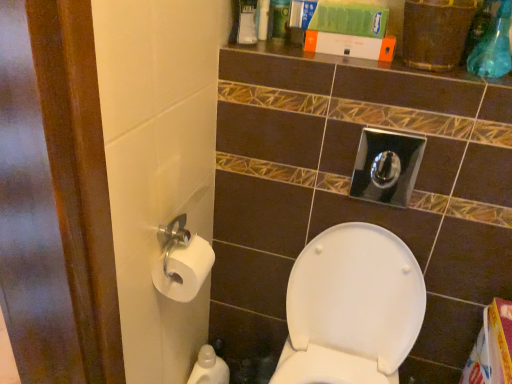
Find the location of `white glossy toilet seat at center`. white glossy toilet seat at center is located at coordinates (351, 308).

Is point (260, 11) closer or farther from the camera than point (328, 278)?

Point (260, 11).

The height and width of the screenshot is (384, 512). In order to click on the 2nd toiletry above the white glossy toilet seat at center (from a real-world perspective) in this screenshot , I will do `click(263, 19)`.

Looking at this image, is white plastic container at upper center, acting as the 2th toiletry starting from the left, oriented away from white glossy toilet seat at center?

No, white plastic container at upper center, acting as the 2th toiletry starting from the left, is not facing the opposite direction of white glossy toilet seat at center.

From the picture: Is white plastic container at upper center, acting as the 2th toiletry starting from the left, completely or partially outside of white glossy toilet seat at center?

Yes.

Could you measure the distance between white glossy plastic bottle at lower left and white paper at left, the first toiletry positioned from the left?

They are 21.55 inches apart.

Is white glossy plastic bottle at lower left closer to the viewer compared to white paper at left, which is the second toiletry in back-to-front order?

That is False.

From the picture: Is white glossy plastic bottle at lower left oriented towards white paper at left, the 2th toiletry positioned from the top?

No, white glossy plastic bottle at lower left is not facing towards white paper at left, the 2th toiletry positioned from the top.

Is white glossy plastic bottle at lower left positioned beyond the bounds of white paper at left, which ranks as the 1th toiletry in front-to-back order?

That's correct, white glossy plastic bottle at lower left is outside of white paper at left, which ranks as the 1th toiletry in front-to-back order.

How far apart are white glossy plastic bottle at lower left and white glossy toilet seat at center?

white glossy plastic bottle at lower left and white glossy toilet seat at center are 18.28 inches apart.

Based on the photo, what's the angular difference between white glossy plastic bottle at lower left and white glossy toilet seat at center's facing directions?

The angular difference between white glossy plastic bottle at lower left and white glossy toilet seat at center is 88 degrees.

Is white glossy plastic bottle at lower left directly adjacent to white glossy toilet seat at center?

No.

Can you confirm if white glossy plastic bottle at lower left is smaller than white glossy toilet seat at center?

Yes.

Is white paper at left, which is the first toiletry in bottom-to-top order, not near white glossy toilet seat at center?

No, white paper at left, which is the first toiletry in bottom-to-top order, is not far from white glossy toilet seat at center.

From the image's perspective, is white paper at left, positioned as the second toiletry in right-to-left order, on white glossy toilet seat at center?

Yes, from the image's perspective, white paper at left, positioned as the second toiletry in right-to-left order, is over white glossy toilet seat at center.

Would you say white paper at left, positioned as the second toiletry in right-to-left order, contains white glossy toilet seat at center?

No, white glossy toilet seat at center is not surrounded by white paper at left, positioned as the second toiletry in right-to-left order.

Consider the image. From the image's perspective, is white glossy toilet seat at center above or below white glossy plastic bottle at lower left?

white glossy toilet seat at center is situated higher than white glossy plastic bottle at lower left in the image.

Considering the positions of points (344, 325) and (218, 374), is point (344, 325) farther from camera compared to point (218, 374)?

No, it is not.

What's the angular difference between white glossy toilet seat at center and white glossy plastic bottle at lower left's facing directions?

They differ by 88 degrees in their facing directions.

How distant is white glossy toilet seat at center from white glossy plastic bottle at lower left?

white glossy toilet seat at center is 18.28 inches away from white glossy plastic bottle at lower left.

Could you tell me if white paper at left, which ranks as the 1th toiletry in front-to-back order, is turned towards white glossy plastic bottle at lower left?

No, white paper at left, which ranks as the 1th toiletry in front-to-back order, is not turned towards white glossy plastic bottle at lower left.

From the image's perspective, between white paper at left, the first toiletry positioned from the left, and white glossy plastic bottle at lower left, which one is located above?

white paper at left, the first toiletry positioned from the left, is shown above in the image.

Which object is positioned more to the left, white paper at left, which is the second toiletry in back-to-front order, or white glossy plastic bottle at lower left?

white paper at left, which is the second toiletry in back-to-front order.

The height and width of the screenshot is (384, 512). In order to click on cleaning product below the white plastic container at upper center, which appears as the 1th toiletry when viewed from the top (from a real-world perspective) in this screenshot , I will do `click(209, 368)`.

Based on the photo, in terms of width, does white glossy plastic bottle at lower left look wider or thinner when compared to white plastic container at upper center, acting as the 2th toiletry starting from the left?

white glossy plastic bottle at lower left is wider than white plastic container at upper center, acting as the 2th toiletry starting from the left.

From the image's perspective, is white glossy plastic bottle at lower left located beneath white plastic container at upper center, the second toiletry positioned from the bottom?

Correct, white glossy plastic bottle at lower left appears lower than white plastic container at upper center, the second toiletry positioned from the bottom, in the image.

This screenshot has height=384, width=512. In order to click on toilet below the white plastic container at upper center, which ranks as the first toiletry in right-to-left order (from the image's perspective) in this screenshot , I will do `click(351, 308)`.

There is a white glossy plastic bottle at lower left. Identify the location of the 1st toiletry above it (from a real-world perspective). (183, 268).

From the image, which object appears to be nearer to white plastic container at upper center, which ranks as the 2th toiletry in front-to-back order, white glossy plastic bottle at lower left or white paper at left, the 2th toiletry positioned from the top?

white paper at left, the 2th toiletry positioned from the top, is closer to white plastic container at upper center, which ranks as the 2th toiletry in front-to-back order.

Based on their spatial positions, is white paper at left, which ranks as the 1th toiletry in front-to-back order, or white glossy plastic bottle at lower left closer to white glossy toilet seat at center?

white glossy plastic bottle at lower left is positioned closer to the anchor white glossy toilet seat at center.

From the image, which object appears to be nearer to white plastic container at upper center, the 1th toiletry positioned from the back, white paper at left, the first toiletry positioned from the left, or white glossy toilet seat at center?

white paper at left, the first toiletry positioned from the left, lies closer to white plastic container at upper center, the 1th toiletry positioned from the back, than the other object.

When comparing their distances from white plastic container at upper center, the second toiletry positioned from the bottom, does white glossy toilet seat at center or white glossy plastic bottle at lower left seem closer?

white glossy toilet seat at center lies closer to white plastic container at upper center, the second toiletry positioned from the bottom, than the other object.

Which object lies further to the anchor point white glossy toilet seat at center, white glossy plastic bottle at lower left or white plastic container at upper center, which ranks as the first toiletry in right-to-left order?

The object further to white glossy toilet seat at center is white plastic container at upper center, which ranks as the first toiletry in right-to-left order.

When comparing their distances from white glossy plastic bottle at lower left, does white paper at left, the first toiletry positioned from the left, or white plastic container at upper center, acting as the 2th toiletry starting from the left, seem further?

The object further to white glossy plastic bottle at lower left is white plastic container at upper center, acting as the 2th toiletry starting from the left.

When comparing their distances from white paper at left, which ranks as the 1th toiletry in front-to-back order, does white plastic container at upper center, the 1th toiletry positioned from the back, or white glossy toilet seat at center seem further?

Among the two, white plastic container at upper center, the 1th toiletry positioned from the back, is located further to white paper at left, which ranks as the 1th toiletry in front-to-back order.

Based on their spatial positions, is white glossy plastic bottle at lower left or white glossy toilet seat at center closer to white paper at left, which is the second toiletry in back-to-front order?

white glossy toilet seat at center lies closer to white paper at left, which is the second toiletry in back-to-front order, than the other object.

This screenshot has height=384, width=512. Find the location of `toiletry between white plastic container at upper center, the 1th toiletry positioned from the back, and white glossy plastic bottle at lower left from top to bottom`. toiletry between white plastic container at upper center, the 1th toiletry positioned from the back, and white glossy plastic bottle at lower left from top to bottom is located at coordinates (183, 268).

Identify the location of toilet between white plastic container at upper center, the 1th toiletry positioned from the back, and white glossy plastic bottle at lower left vertically. (351, 308).

Where is `toiletry between white plastic container at upper center, which appears as the 1th toiletry when viewed from the top, and white glossy toilet seat at center vertically`? toiletry between white plastic container at upper center, which appears as the 1th toiletry when viewed from the top, and white glossy toilet seat at center vertically is located at coordinates (183, 268).